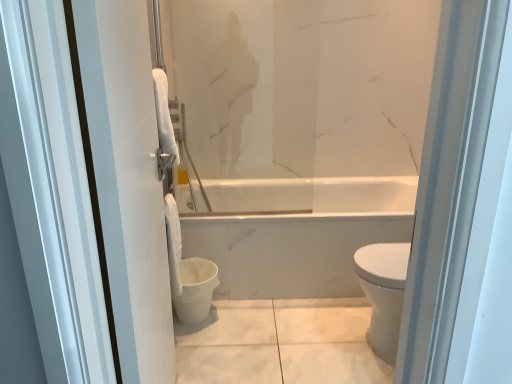
Question: Does white fabric towel at lower center appear on the left side of white matte toilet bowl at lower center?

Choices:
 (A) yes
 (B) no

Answer: (A)

Question: Is white fabric towel at lower center not close to white matte toilet bowl at lower center?

Choices:
 (A) no
 (B) yes

Answer: (A)

Question: From a real-world perspective, is white fabric towel at lower center beneath white matte toilet bowl at lower center?

Choices:
 (A) no
 (B) yes

Answer: (A)

Question: From the image's perspective, is white fabric towel at lower center located above white matte toilet bowl at lower center?

Choices:
 (A) no
 (B) yes

Answer: (B)

Question: Is white fabric towel at lower center taller than white matte toilet bowl at lower center?

Choices:
 (A) no
 (B) yes

Answer: (B)

Question: Can you confirm if white fabric towel at lower center is shorter than white matte toilet bowl at lower center?

Choices:
 (A) yes
 (B) no

Answer: (B)

Question: Does white glossy towel at left have a lesser width compared to white matte toilet bowl at lower center?

Choices:
 (A) yes
 (B) no

Answer: (A)

Question: From a real-world perspective, is white glossy towel at left physically above white matte toilet bowl at lower center?

Choices:
 (A) no
 (B) yes

Answer: (B)

Question: Considering the relative positions of white glossy towel at left and white matte toilet bowl at lower center in the image provided, is white glossy towel at left in front of white matte toilet bowl at lower center?

Choices:
 (A) yes
 (B) no

Answer: (A)

Question: Does white glossy towel at left have a greater height compared to white matte toilet bowl at lower center?

Choices:
 (A) no
 (B) yes

Answer: (B)

Question: Can you confirm if white glossy towel at left is wider than white matte toilet bowl at lower center?

Choices:
 (A) yes
 (B) no

Answer: (B)

Question: Is white glossy towel at left at the left side of white matte toilet bowl at lower center?

Choices:
 (A) yes
 (B) no

Answer: (A)

Question: Is white fabric towel at lower center to the right of white glossy towel at left from the viewer's perspective?

Choices:
 (A) yes
 (B) no

Answer: (B)